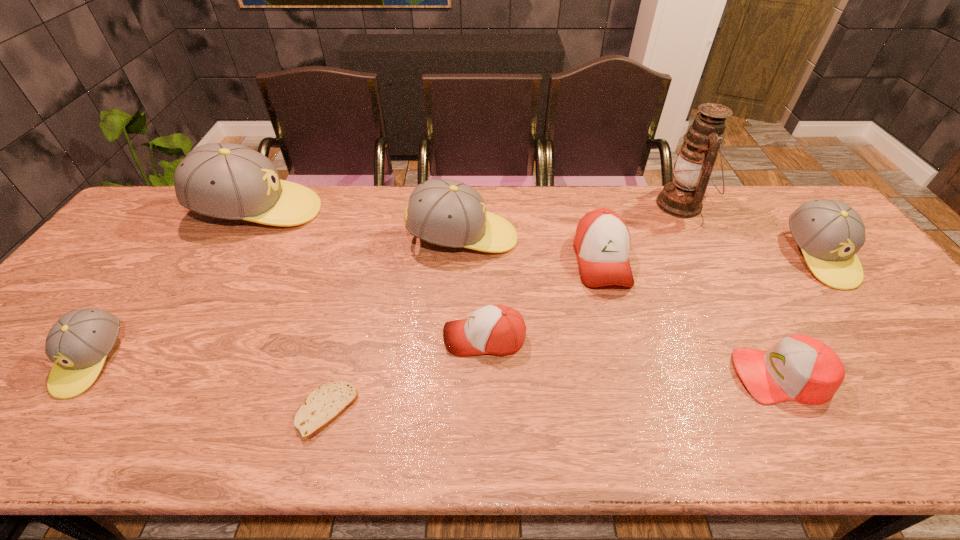
Find the location of `the tallest object`. the tallest object is located at coordinates (683, 197).

What are the coordinates of `the tallest baseball cap` in the screenshot? It's located at (229, 181).

Find the location of a particular element. The height and width of the screenshot is (540, 960). the biggest yellow baseball cap is located at coordinates (229, 181).

Where is `the sixth shortest baseball cap`? Image resolution: width=960 pixels, height=540 pixels. the sixth shortest baseball cap is located at coordinates (445, 212).

Where is `the seventh shortest object`? the seventh shortest object is located at coordinates (445, 212).

The height and width of the screenshot is (540, 960). Identify the location of the third biggest yellow baseball cap. (829, 232).

Find the location of a particular element. This screenshot has width=960, height=540. the rightmost baseball cap is located at coordinates (829, 232).

At what (x,y) coordinates should I click in order to perform the action: click on the sixth object from left to right. Please return your answer as a coordinate pair (x, y). The width and height of the screenshot is (960, 540). Looking at the image, I should click on pos(602,241).

You are a GUI agent. You are given a task and a screenshot of the screen. Output one action in this format:
    pyautogui.click(x=<x>, y=<y>)
    Task: Click on the farther orange baseball cap
    This screenshot has height=540, width=960.
    Given the screenshot: What is the action you would take?
    pyautogui.click(x=602, y=241)

Locate an element on the screen. This screenshot has width=960, height=540. the smallest yellow baseball cap is located at coordinates (78, 343).